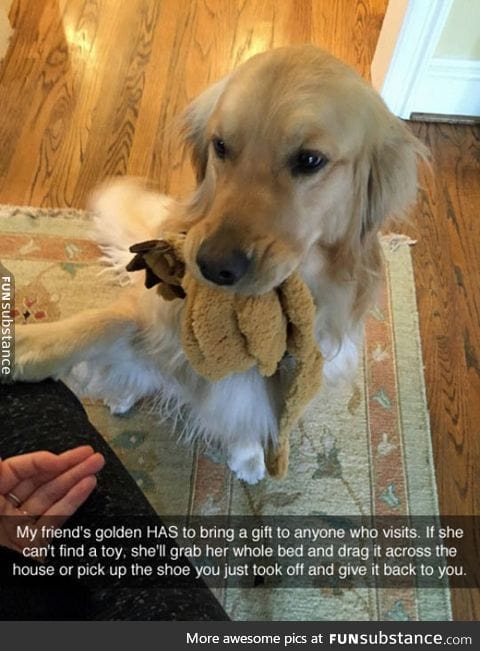
Image resolution: width=480 pixels, height=651 pixels. I want to click on wood floor, so click(98, 88).